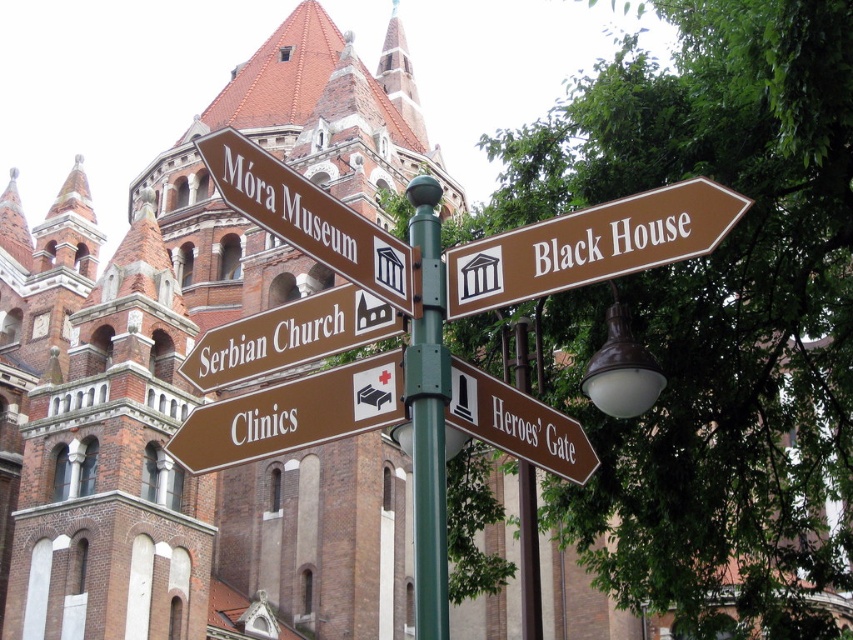
Can you confirm if brown matte sign at upper right is positioned to the right of brown wooden sign at lower right?

Correct, you'll find brown matte sign at upper right to the right of brown wooden sign at lower right.

Which is above, brown matte sign at upper right or brown wooden sign at lower right?

Positioned higher is brown matte sign at upper right.

The image size is (853, 640). What do you see at coordinates (590, 244) in the screenshot?
I see `brown matte sign at upper right` at bounding box center [590, 244].

You are a GUI agent. You are given a task and a screenshot of the screen. Output one action in this format:
    pyautogui.click(x=<x>, y=<y>)
    Task: Click on the brown matte sign at upper right
    This screenshot has height=640, width=853.
    Given the screenshot: What is the action you would take?
    pyautogui.click(x=590, y=244)

Does brown matte sign at upper right have a greater width compared to brown matte sign at center?

No.

Is brown matte sign at upper right below brown matte sign at center?

No, brown matte sign at upper right is not below brown matte sign at center.

Does point (679, 220) lie behind point (216, 451)?

No, it is in front of (216, 451).

At what (x,y) coordinates should I click in order to perform the action: click on brown matte sign at upper right. Please return your answer as a coordinate pair (x, y). The image size is (853, 640). Looking at the image, I should click on (590, 244).

Between brown matte sign at upper right and brown wooden sign at upper center, which one appears on the right side from the viewer's perspective?

brown matte sign at upper right

Does brown matte sign at upper right appear on the right side of brown wooden sign at upper center?

Yes, brown matte sign at upper right is to the right of brown wooden sign at upper center.

At what (x,y) coordinates should I click in order to perform the action: click on brown matte sign at upper right. Please return your answer as a coordinate pair (x, y). The width and height of the screenshot is (853, 640). Looking at the image, I should click on (590, 244).